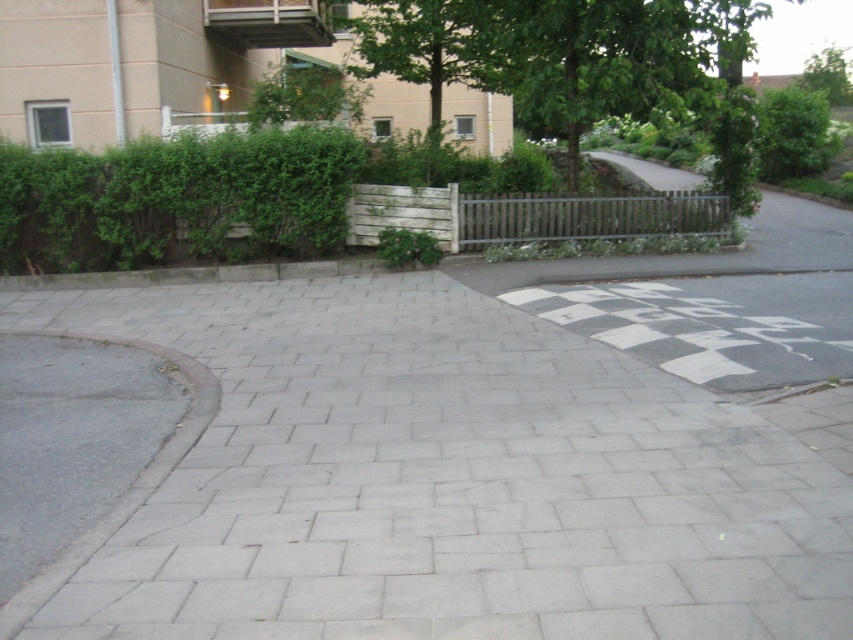
You are standing at the intersection of the road and the pedestrian walkway. You need to reach the gray concrete pavement at center as quickly as possible. Which direction should you move towards?

The gray concrete pavement at center is located at point (450, 480), so you should move towards the center of the image to reach it quickly.

You are standing on the gray concrete pavement at center, which is represented by point (x=450, y=480). You want to walk to the beige building with balcony and window in the background. Which direction should you move relative to the gray concrete pavement at center?

You should move towards the beige building with balcony and window in the background, which is located in the background relative to the gray concrete pavement at center.